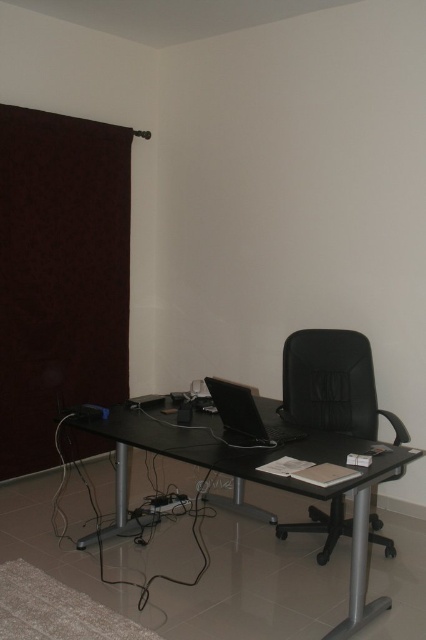
You are organizing the office and need to place a new monitor on the desk. The monitor requires 30 cm of space in front of it. Can you determine if there is enough space on the black glass computer desk at center for the monitor based on its position relative to the black glossy laptop at center?

The black glass computer desk at center is positioned under the black glossy laptop at center, which means there is sufficient space on the desk in front of the laptop to accommodate the monitor requiring 30 cm of space.

You are standing in the office and want to place a small plant between the two points, point (45, 451) and point (345, 449). Which point should the plant be closer to in order to be closer to you?

The plant should be closer to point (45, 451) because it is further to the viewer than point (345, 449).